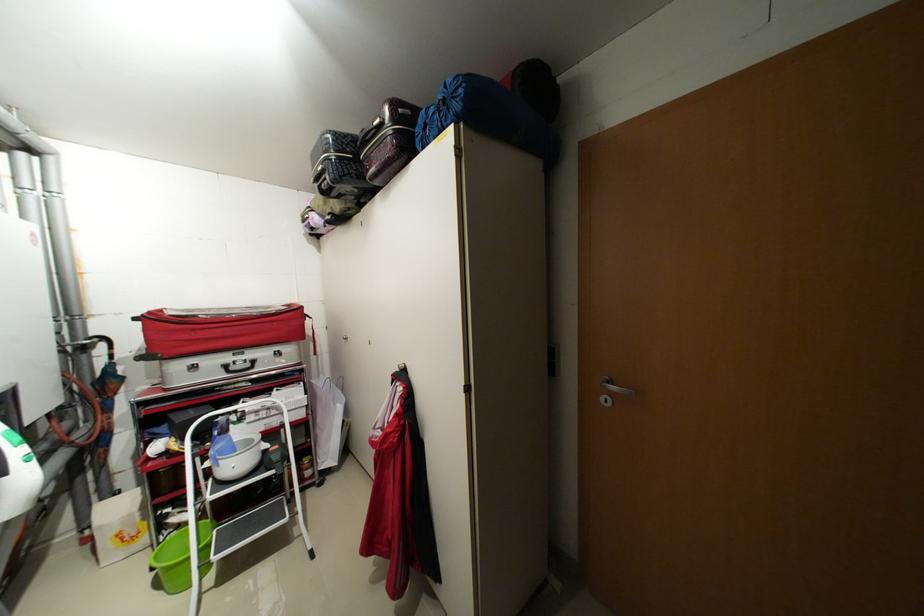
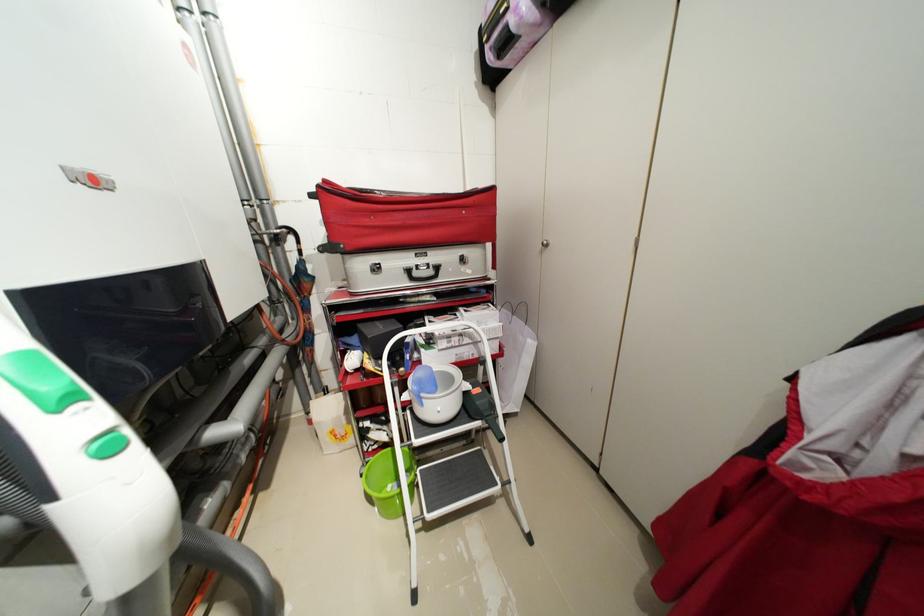
The point at (224, 461) is marked in the first image. Where is the corresponding point in the second image?

(428, 400)